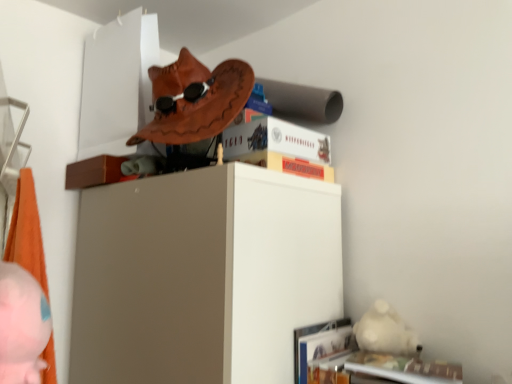
Question: Are monopoly board game at upper center, which ranks as the 2th paperback book in top-to-bottom order, and hardcover book at upper center, which ranks as the 2th paperback book in bottom-to-top order, making contact?

Choices:
 (A) yes
 (B) no

Answer: (A)

Question: From the image's perspective, would you say monopoly board game at upper center, which ranks as the 2th paperback book in top-to-bottom order, is positioned over hardcover book at upper center, the 1th paperback book positioned from the top?

Choices:
 (A) yes
 (B) no

Answer: (B)

Question: Could you tell me if monopoly board game at upper center, the 1th paperback book in the bottom-to-top sequence, is turned towards hardcover book at upper center, which ranks as the 2th paperback book in bottom-to-top order?

Choices:
 (A) no
 (B) yes

Answer: (A)

Question: Can we say monopoly board game at upper center, the 1th paperback book in the bottom-to-top sequence, lies outside hardcover book at upper center, which ranks as the 2th paperback book in bottom-to-top order?

Choices:
 (A) yes
 (B) no

Answer: (A)

Question: Does point (50, 326) appear closer or farther from the camera than point (330, 180)?

Choices:
 (A) closer
 (B) farther

Answer: (A)

Question: From the image's perspective, relative to monopoly board game at upper center, the 1th paperback book in the bottom-to-top sequence, is pink plush toy at lower left above or below?

Choices:
 (A) below
 (B) above

Answer: (A)

Question: From a real-world perspective, is pink plush toy at lower left above or below monopoly board game at upper center, which ranks as the 2th paperback book in top-to-bottom order?

Choices:
 (A) above
 (B) below

Answer: (B)

Question: Would you say pink plush toy at lower left is inside or outside monopoly board game at upper center, which ranks as the 2th paperback book in top-to-bottom order?

Choices:
 (A) outside
 (B) inside

Answer: (A)

Question: In terms of height, does hardcover book at upper center, the 1th paperback book positioned from the top, look taller or shorter compared to monopoly board game at upper center, which ranks as the 2th paperback book in top-to-bottom order?

Choices:
 (A) tall
 (B) short

Answer: (A)

Question: In the image, is hardcover book at upper center, the 1th paperback book positioned from the top, positioned in front of or behind monopoly board game at upper center, the 1th paperback book in the bottom-to-top sequence?

Choices:
 (A) behind
 (B) front

Answer: (A)

Question: Is hardcover book at upper center, the 1th paperback book positioned from the top, bigger or smaller than monopoly board game at upper center, the 1th paperback book in the bottom-to-top sequence?

Choices:
 (A) small
 (B) big

Answer: (B)

Question: Considering the positions of point (295, 145) and point (247, 155), is point (295, 145) closer or farther from the camera than point (247, 155)?

Choices:
 (A) closer
 (B) farther

Answer: (B)

Question: From the image's perspective, is monopoly board game at upper center, which ranks as the 2th paperback book in top-to-bottom order, positioned above or below hardcover book at upper center, which ranks as the 2th paperback book in bottom-to-top order?

Choices:
 (A) above
 (B) below

Answer: (B)

Question: Based on their sizes in the image, would you say monopoly board game at upper center, which ranks as the 2th paperback book in top-to-bottom order, is bigger or smaller than hardcover book at upper center, the 1th paperback book positioned from the top?

Choices:
 (A) small
 (B) big

Answer: (A)